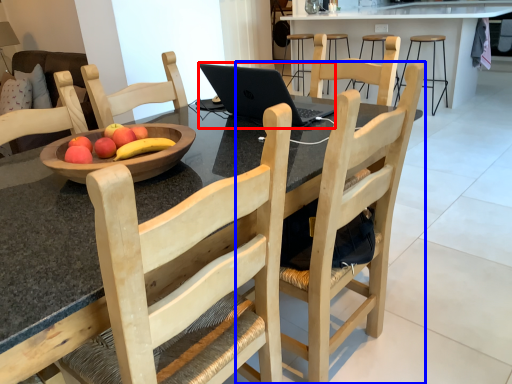
Question: Which point is closer to the camera, laptop (highlighted by a red box) or chair (highlighted by a blue box)?

Choices:
 (A) laptop
 (B) chair

Answer: (B)